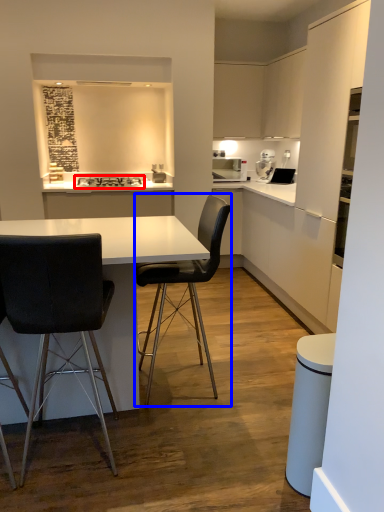
Question: Which object is further to the camera taking this photo, stove (highlighted by a red box) or chair (highlighted by a blue box)?

Choices:
 (A) stove
 (B) chair

Answer: (A)